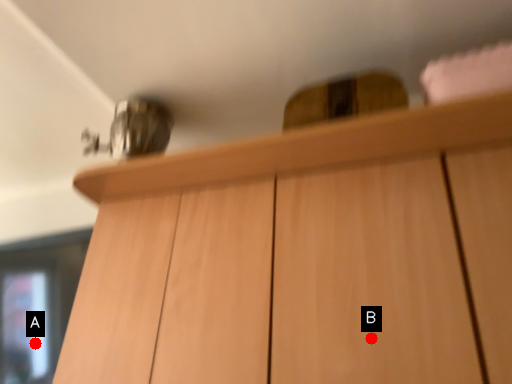
Question: Two points are circled on the image, labeled by A and B beside each circle. Which point is closer to the camera taking this photo?

Choices:
 (A) A is closer
 (B) B is closer

Answer: (B)